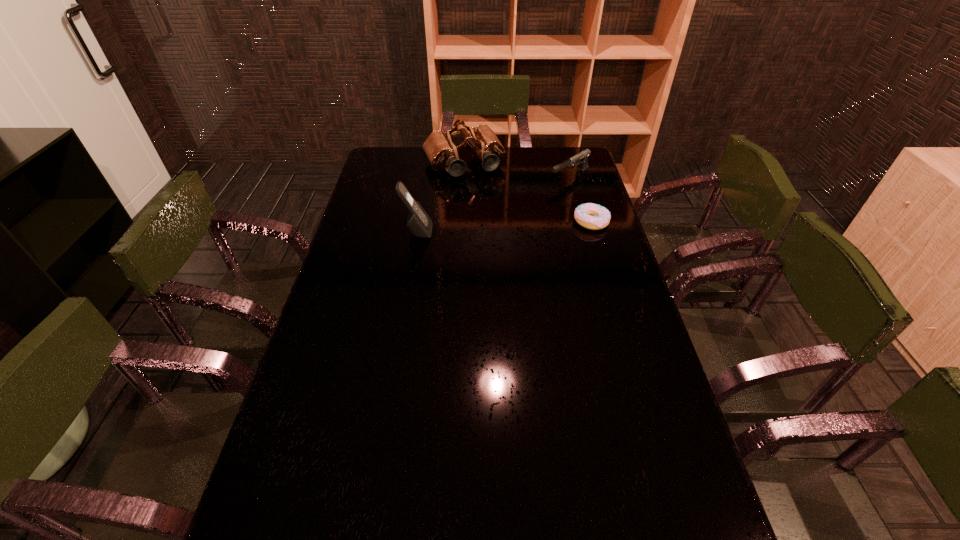
Where is `free location located 0.220m at the muzzle end of the second shortest object`? The width and height of the screenshot is (960, 540). free location located 0.220m at the muzzle end of the second shortest object is located at coordinates (517, 206).

The image size is (960, 540). In order to click on blank space located at the muzzle end of the second shortest object in this screenshot , I will do `click(528, 200)`.

Where is `binoculars at the far edge`? binoculars at the far edge is located at coordinates (441, 152).

Where is `gun at the far edge`? This screenshot has height=540, width=960. gun at the far edge is located at coordinates (582, 157).

At what (x,y) coordinates should I click in order to perform the action: click on doughnut that is at the right edge. Please return your answer as a coordinate pair (x, y). Looking at the image, I should click on (592, 216).

Identify the location of gun situated at the right edge. This screenshot has height=540, width=960. (582, 157).

Identify the location of object present at the far right corner. (582, 157).

In the image, there is a desktop. Where is `free space at the near edge`? The width and height of the screenshot is (960, 540). free space at the near edge is located at coordinates (599, 504).

I want to click on vacant space at the left edge of the desktop, so click(x=364, y=234).

In the image, there is a desktop. At what (x,y) coordinates should I click in order to perform the action: click on free space at the right edge. Please return your answer as a coordinate pair (x, y). The height and width of the screenshot is (540, 960). Looking at the image, I should click on (646, 368).